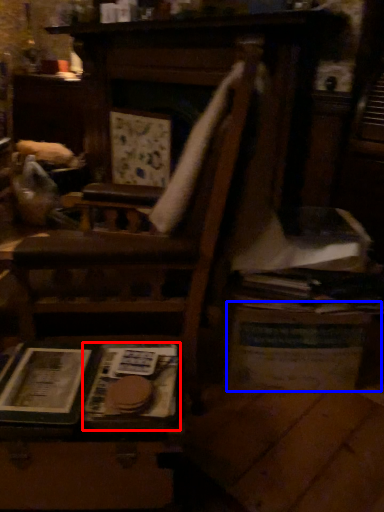
Question: Which object is closer to the camera taking this photo, paperback book (highlighted by a red box) or table (highlighted by a blue box)?

Choices:
 (A) paperback book
 (B) table

Answer: (A)